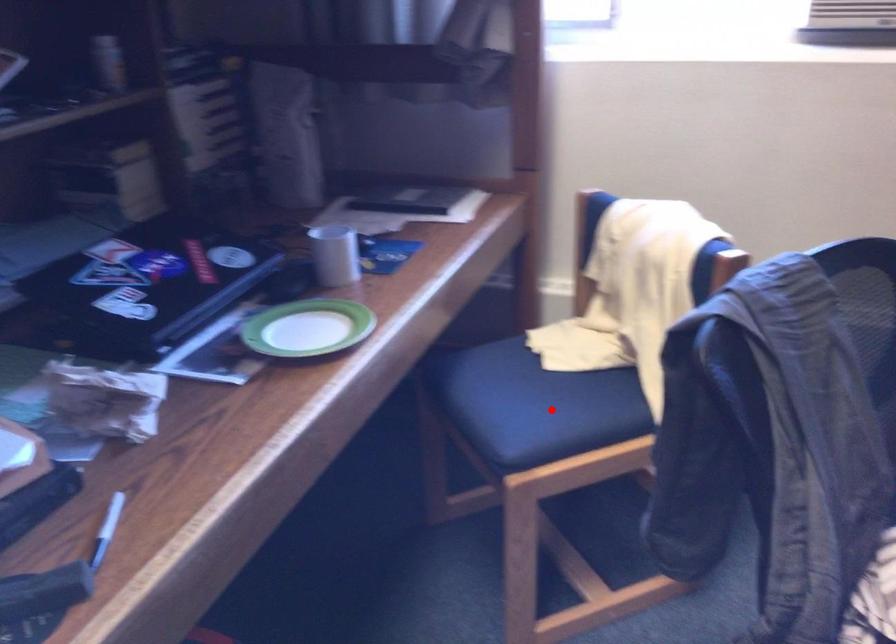
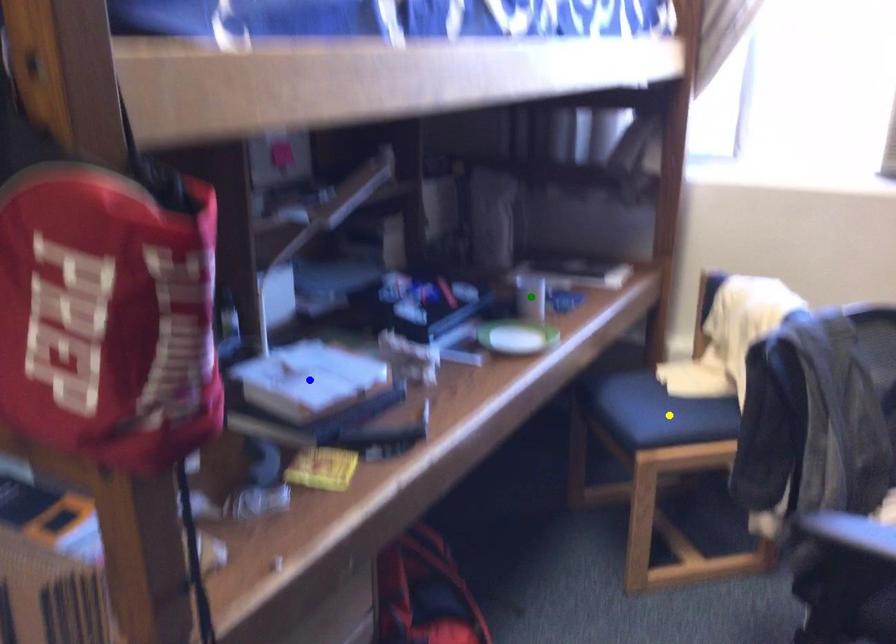
Question: I am providing you with two images of the same scene from different viewpoints. A red point is marked on the first image. You are given multiple points on the second image. Which mark in image 2 goes with the point in image 1?

Choices:
 (A) blue point
 (B) green point
 (C) yellow point

Answer: (C)